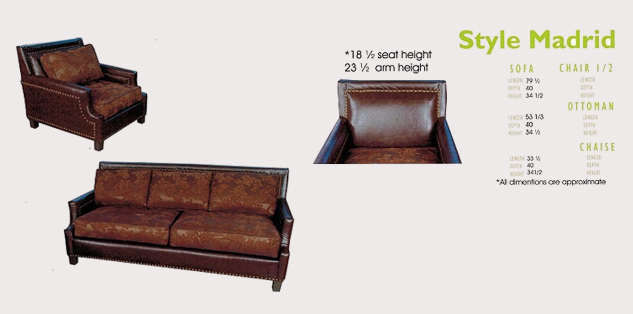
You are a GUI agent. You are given a task and a screenshot of the screen. Output one action in this format:
    pyautogui.click(x=<x>, y=<y>)
    Task: Click on the line where right chair is cut off
    
    Given the screenshot: What is the action you would take?
    pyautogui.click(x=382, y=164)